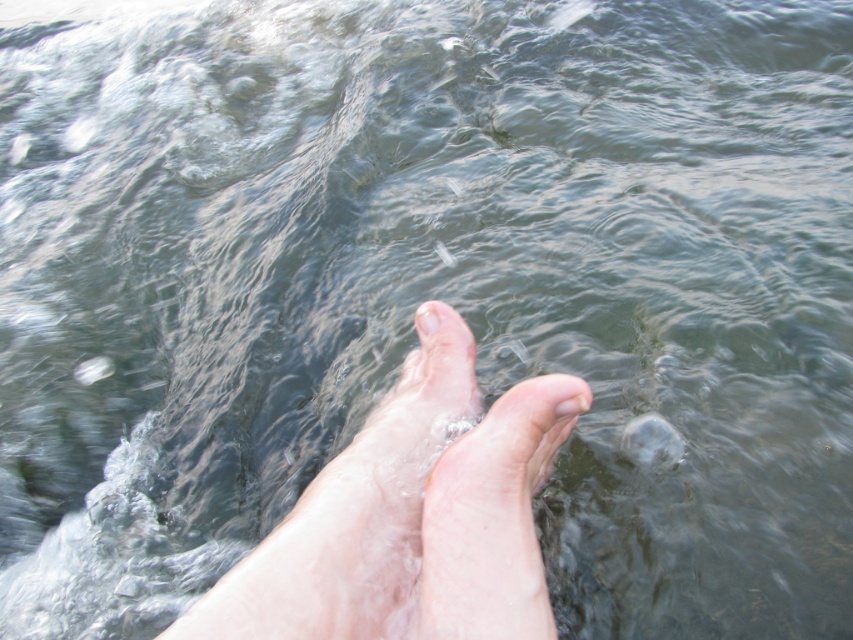
Who is higher up, pale skin feet at center or pale skin foot at center?

pale skin feet at center is above.

Who is positioned more to the right, pale skin feet at center or pale skin foot at center?

pale skin foot at center

Who is more distant from viewer, (x=410, y=429) or (x=432, y=605)?

The point (x=410, y=429) is more distant.

Where is `pale skin feet at center`? The width and height of the screenshot is (853, 640). pale skin feet at center is located at coordinates (410, 516).

Is pale skin foot at center smaller than pale skin toe at center?

Incorrect, pale skin foot at center is not smaller in size than pale skin toe at center.

Is point (454, 611) positioned in front of point (425, 332)?

That is True.

The width and height of the screenshot is (853, 640). Identify the location of pale skin foot at center. (492, 516).

Is pale skin feet at center below pale skin toe at center?

Yes.

Between pale skin feet at center and pale skin toe at center, which one is positioned lower?

pale skin feet at center is below.

Which is in front, point (421, 465) or point (419, 314)?

Point (421, 465) is more forward.

Locate an element on the screen. The image size is (853, 640). pale skin feet at center is located at coordinates (410, 516).